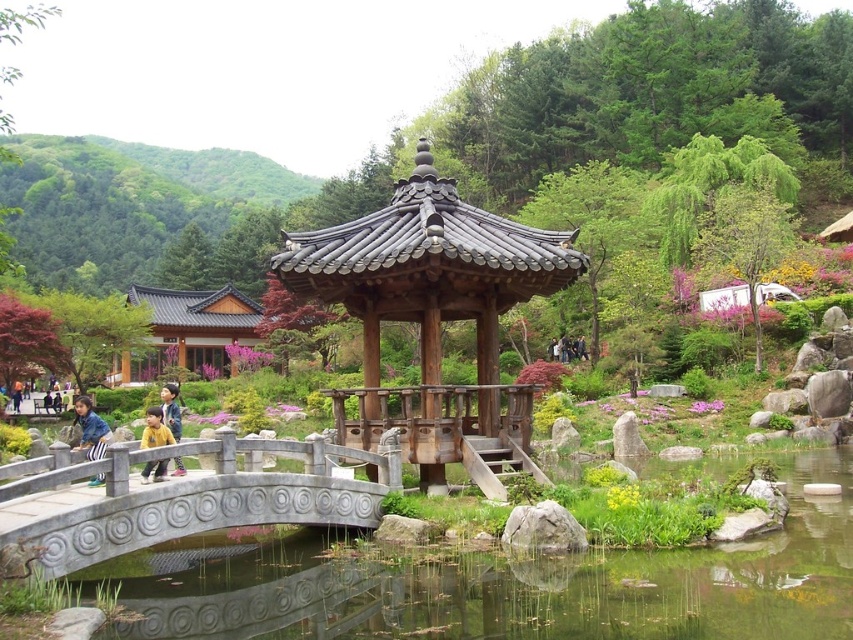
Question: Considering the real-world distances, which object is farthest from the denim jacket at lower left?

Choices:
 (A) wooden gazebo at center
 (B) gray stone bridge at lower left
 (C) yellow cotton shirt at center

Answer: (A)

Question: Is clear water at bridge left bigger than yellow matte jacket at center?

Choices:
 (A) yes
 (B) no

Answer: (A)

Question: Can you confirm if clear water at bridge left is bigger than denim jacket at lower left?

Choices:
 (A) yes
 (B) no

Answer: (A)

Question: Is denim jacket at lower left smaller than yellow cotton shirt at center?

Choices:
 (A) no
 (B) yes

Answer: (B)

Question: Which point appears farthest from the camera in this image?

Choices:
 (A) (80, 445)
 (B) (160, 417)

Answer: (A)

Question: Which point appears farthest from the camera in this image?

Choices:
 (A) (492, 419)
 (B) (88, 419)
 (C) (163, 468)

Answer: (A)